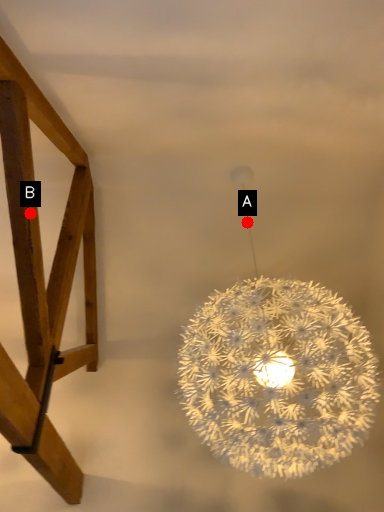
Question: Two points are circled on the image, labeled by A and B beside each circle. Which point is closer to the camera?

Choices:
 (A) A is closer
 (B) B is closer

Answer: (B)